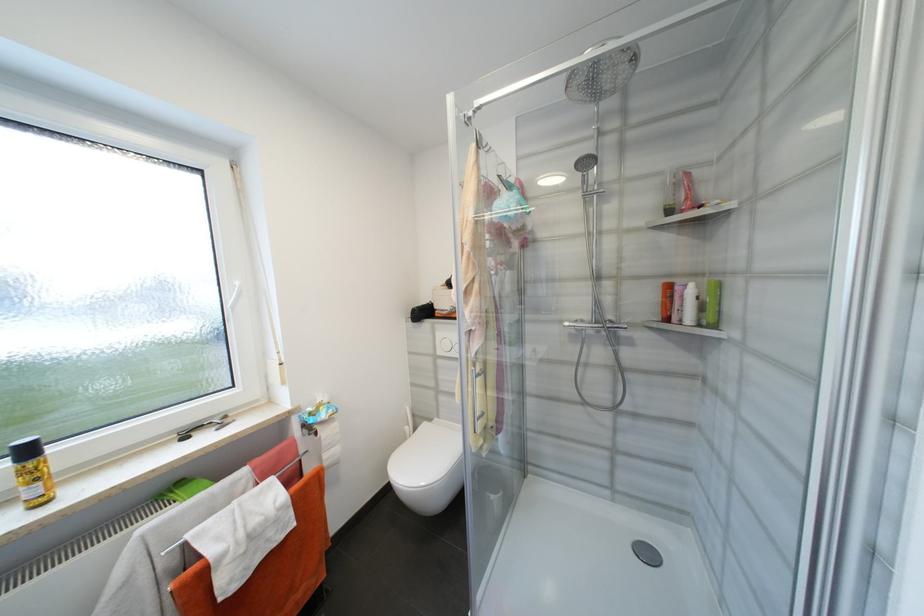
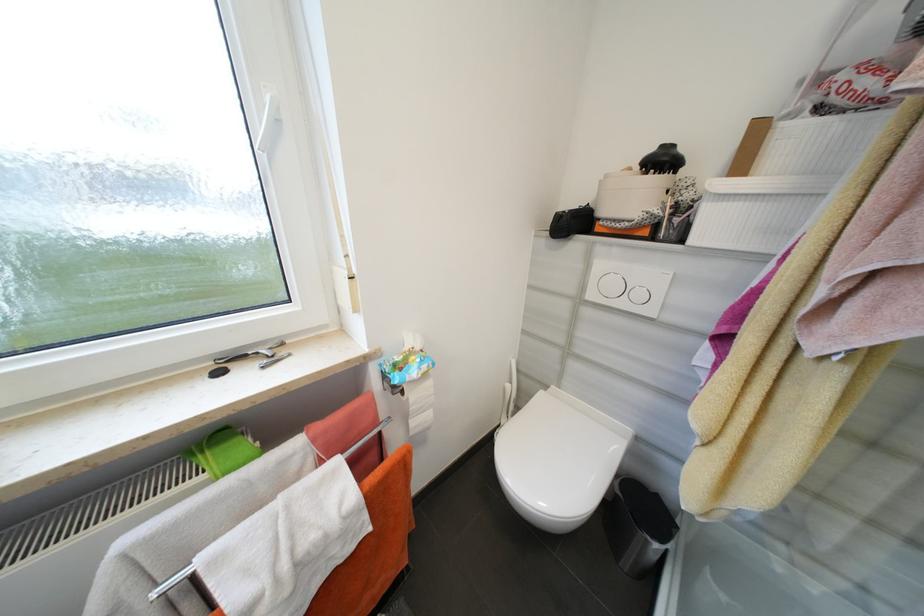
In the second image, find the point that corresponds to the point at 335,411 in the first image.

(430, 368)